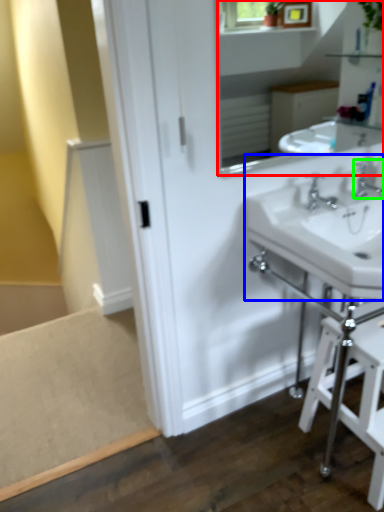
Question: Considering the real-world distances, which object is farthest from mirror (highlighted by a red box)? sink (highlighted by a blue box) or tap (highlighted by a green box)?

Choices:
 (A) sink
 (B) tap

Answer: (A)